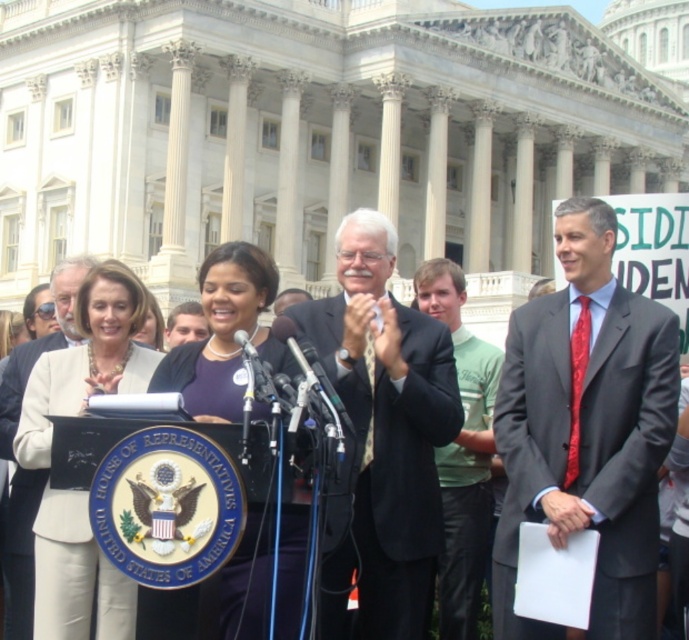
Is dark suit at center below matte purple dress at center?

No, dark suit at center is not below matte purple dress at center.

Which of these two, dark suit at center or matte purple dress at center, stands shorter?

matte purple dress at center

The height and width of the screenshot is (640, 689). In order to click on dark suit at center in this screenshot , I will do `click(384, 433)`.

This screenshot has height=640, width=689. Find the location of `dark suit at center`. dark suit at center is located at coordinates (384, 433).

Looking at this image, between matte purple dress at center and light brown hair at center, which one has more height?

matte purple dress at center

Which is above, matte purple dress at center or light brown hair at center?

Positioned higher is light brown hair at center.

Between point (200, 416) and point (178, 337), which one is positioned behind?

The point (178, 337) is more distant.

At what (x,y) coordinates should I click in order to perform the action: click on matte purple dress at center. Please return your answer as a coordinate pair (x, y). This screenshot has width=689, height=640. Looking at the image, I should click on (225, 333).

Is dark suit at center closer to camera compared to green cotton shirt at center?

That is True.

Between dark suit at center and green cotton shirt at center, which one has less height?

Standing shorter between the two is green cotton shirt at center.

Find the location of a particular element. dark suit at center is located at coordinates (384, 433).